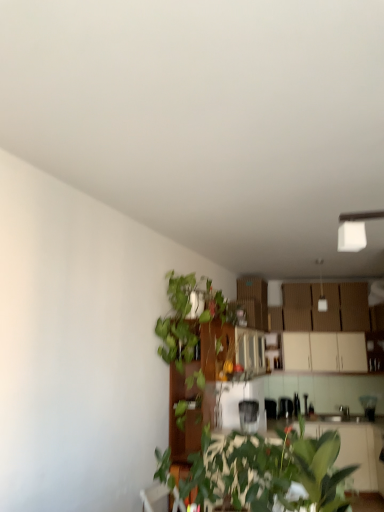
Question: In the image, is white matte cabinet at upper right positioned in front of or behind satin silver toaster at center, the 1th appliance positioned from the front?

Choices:
 (A) front
 (B) behind

Answer: (B)

Question: Is point (332, 344) closer or farther from the camera than point (251, 409)?

Choices:
 (A) closer
 (B) farther

Answer: (B)

Question: Which object is positioned closest to the satin silver toaster at center, the 1th appliance positioned from the front?

Choices:
 (A) metallic silver toaster at center, which is counted as the first appliance, starting from the back
 (B) metallic silver kettle at center, which ranks as the first appliance in right-to-left order
 (C) green leafy plant at center
 (D) green leafy plant at lower center
 (E) white matte cabinet at upper right

Answer: (A)

Question: Which of these objects is positioned closest to the metallic silver toaster at center, which ranks as the third appliance in front-to-back order?

Choices:
 (A) metallic silver kettle at center, placed as the 2th appliance when sorted from top to bottom
 (B) white matte cabinet at upper right
 (C) satin silver toaster at center, marked as the third appliance in a back-to-front arrangement
 (D) green leafy plant at center
 (E) green leafy plant at lower center

Answer: (C)